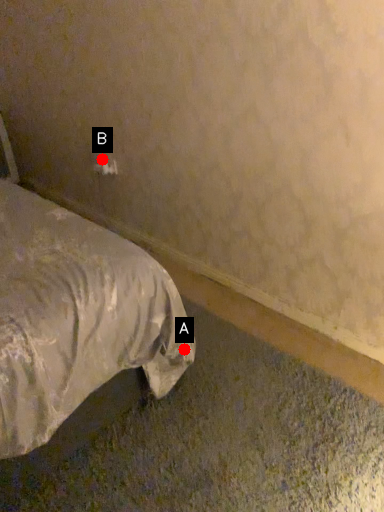
Question: Two points are circled on the image, labeled by A and B beside each circle. Which of the following is the farthest from the observer?

Choices:
 (A) A is further
 (B) B is further

Answer: (B)